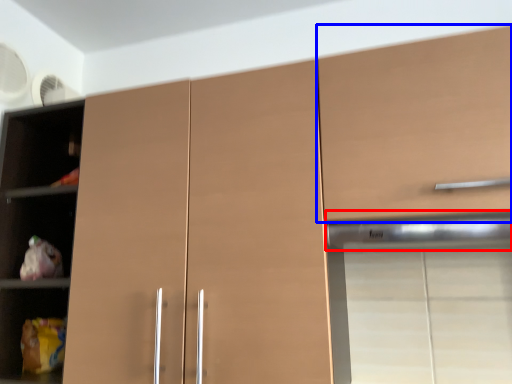
Question: Which object is closer to the camera taking this photo, exhaust hood (highlighted by a red box) or cabinetry (highlighted by a blue box)?

Choices:
 (A) exhaust hood
 (B) cabinetry

Answer: (B)